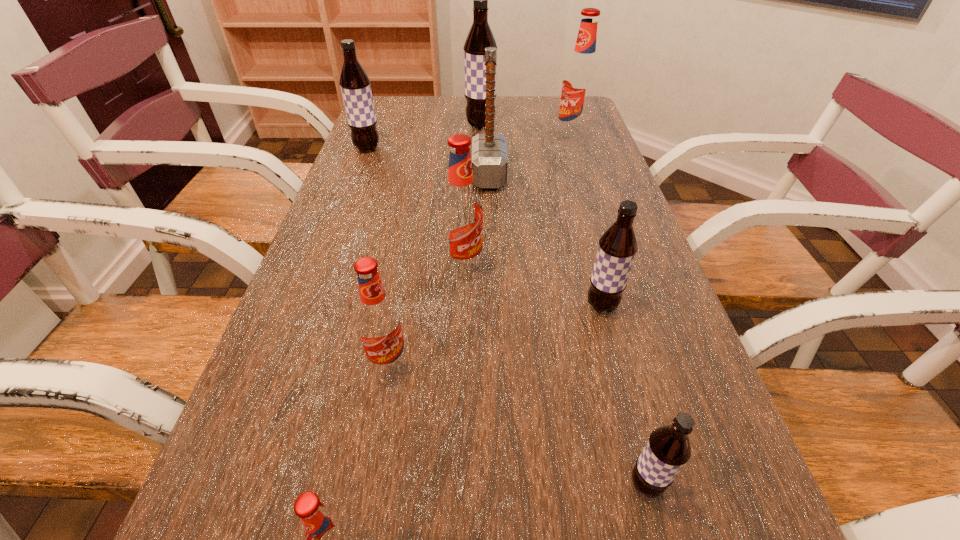
Find the location of `the sixth farthest root beer`. the sixth farthest root beer is located at coordinates (378, 321).

Locate an element on the screen. The height and width of the screenshot is (540, 960). the second nearest red root beer is located at coordinates (378, 321).

Find the location of a particular element. the fourth nearest object is located at coordinates (617, 248).

Where is `the fifth farthest root beer`? The height and width of the screenshot is (540, 960). the fifth farthest root beer is located at coordinates (617, 248).

Identify the location of the eighth farthest object. (667, 450).

The height and width of the screenshot is (540, 960). I want to click on the nearest brown root beer, so click(x=667, y=450).

This screenshot has width=960, height=540. What are the coordinates of `free spot located on the front of the farthest root beer` in the screenshot? It's located at tap(481, 181).

Locate an element on the screen. The width and height of the screenshot is (960, 540). vacant space located 0.050m on the back of the rightmost red root beer is located at coordinates (567, 126).

Find the location of a particular element. The image size is (960, 540). vacant position located 0.210m on the striking surface of the brown hammer is located at coordinates (396, 176).

In order to click on vacant region located on the striking surface of the brown hammer in this screenshot , I will do (429, 176).